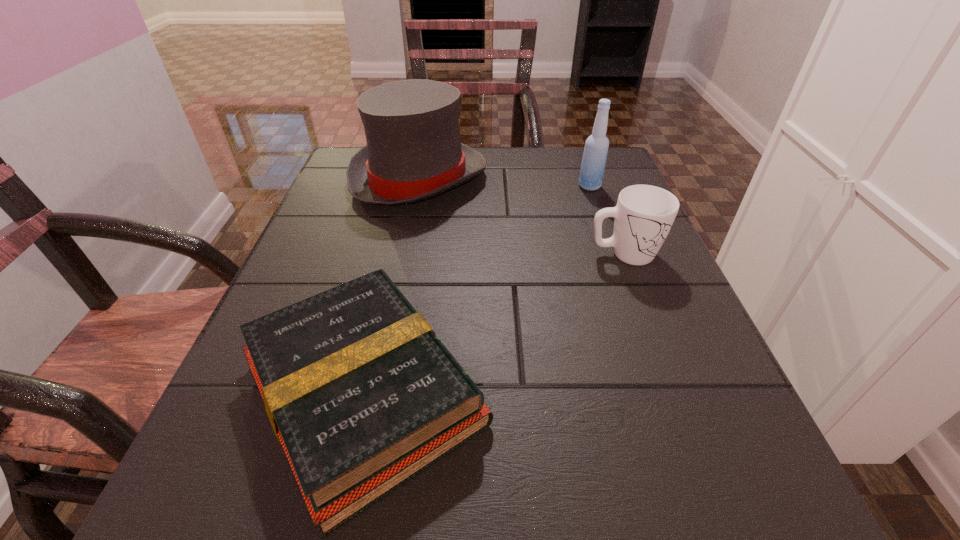
Locate an element on the screen. bottle is located at coordinates (594, 158).

Find the location of a particular element. dress hat is located at coordinates (414, 152).

Identify the location of the second shortest object. (644, 214).

Image resolution: width=960 pixels, height=540 pixels. I want to click on the second nearest object, so click(x=644, y=214).

What are the coordinates of `the shortest object` in the screenshot? It's located at (362, 395).

Find the location of a particular element. The height and width of the screenshot is (540, 960). the nearest object is located at coordinates (362, 395).

Identify the location of vacant space situated on the back of the bottle. The width and height of the screenshot is (960, 540). (579, 154).

Find the location of `vacant space located on the front of the dress hat`. vacant space located on the front of the dress hat is located at coordinates (406, 239).

The height and width of the screenshot is (540, 960). I want to click on vacant space located on the back of the shortest object, so click(411, 185).

Locate an element on the screen. The height and width of the screenshot is (540, 960). bottle that is at the far edge is located at coordinates (594, 158).